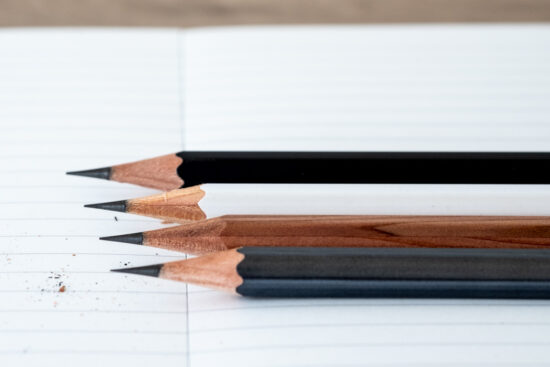
Locate an element on the screen. The height and width of the screenshot is (367, 550). wooden objects is located at coordinates 163,164, 174,202, 195,236, 209,267.